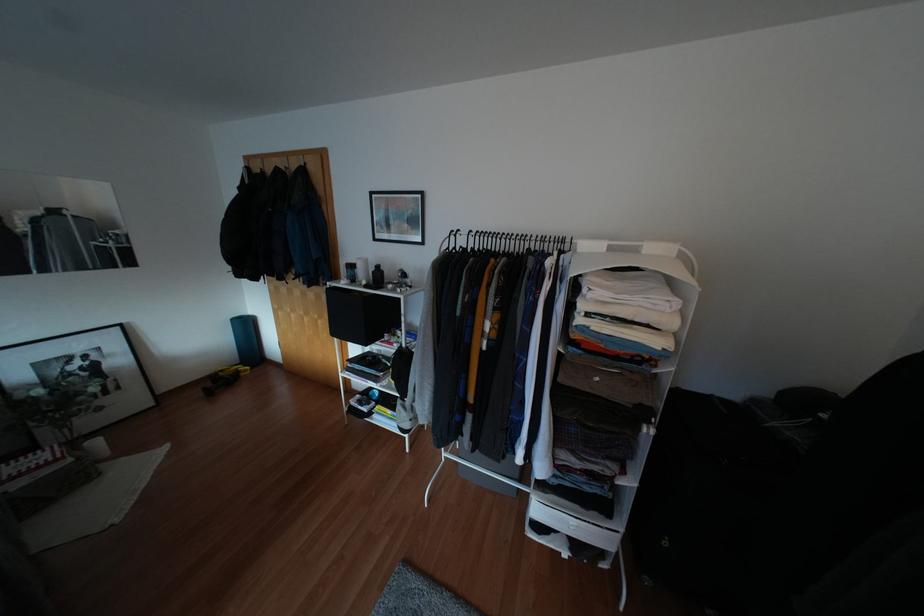
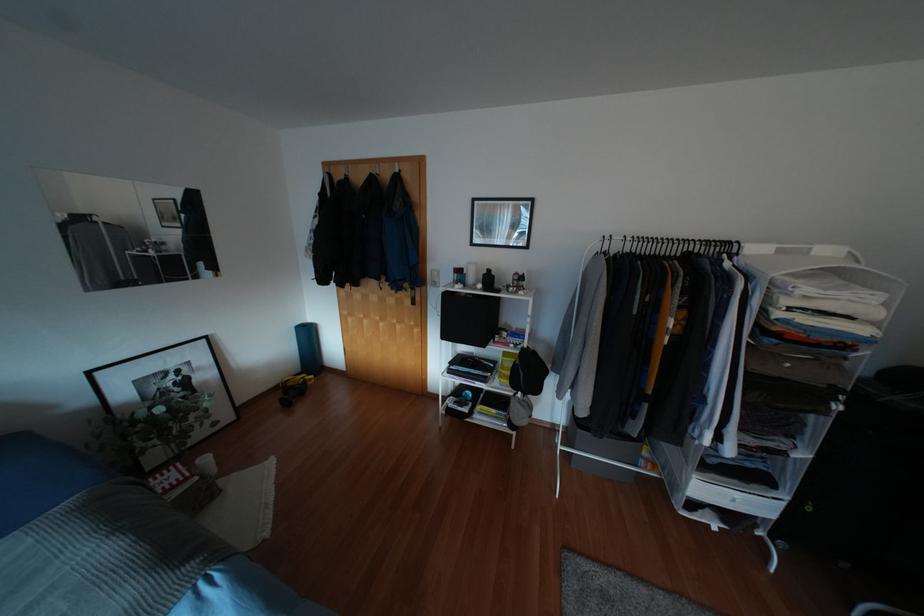
Find the pixel in the second image that matches (x=365, y=286) in the first image.

(483, 289)